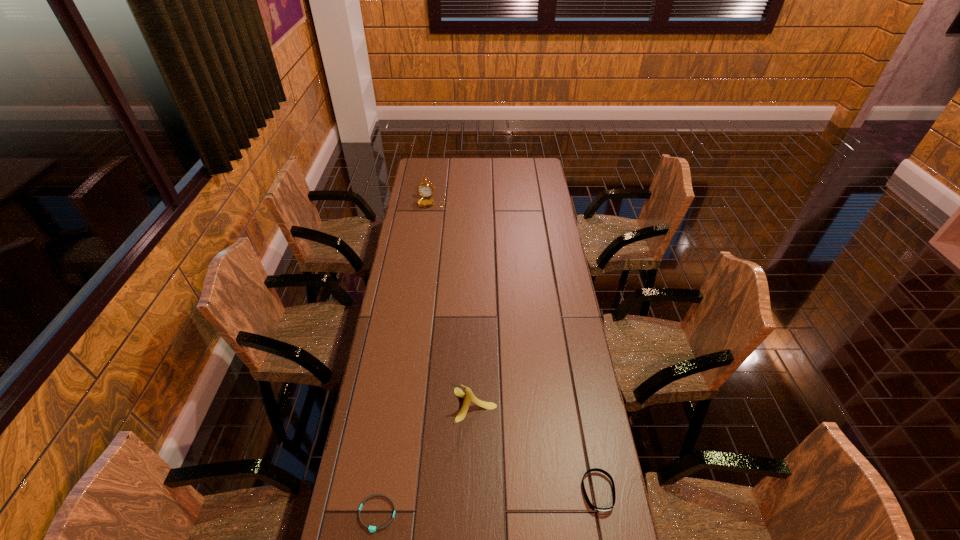
Locate an element on the screen. This screenshot has width=960, height=540. the farthest object is located at coordinates (426, 190).

Identify the location of banana. The height and width of the screenshot is (540, 960). (468, 396).

The height and width of the screenshot is (540, 960). Identify the location of the third object from left to right. (468, 396).

Find the location of a particular element. The image size is (960, 540). the second shortest object is located at coordinates (599, 510).

The image size is (960, 540). In order to click on the taller wristband in this screenshot , I will do tap(599, 510).

Image resolution: width=960 pixels, height=540 pixels. Identify the location of the left wristband. (372, 529).

At what (x,y) coordinates should I click in order to perform the action: click on the shorter wristband. Please return your answer as a coordinate pair (x, y). Looking at the image, I should click on (372, 529).

The height and width of the screenshot is (540, 960). Identify the location of free region located on the face of the pocket watch. (427, 232).

The height and width of the screenshot is (540, 960). Identify the location of vacant area located on the back of the banana. coord(476,353).

Identify the location of pocket watch that is at the left edge. (426, 190).